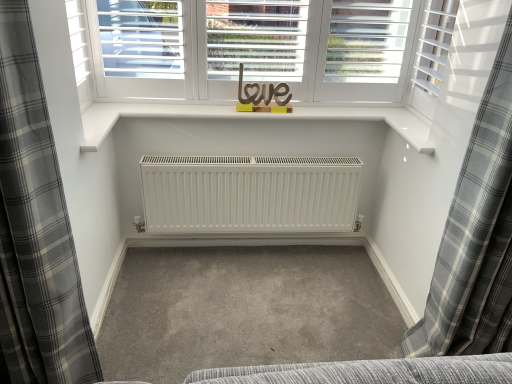
Question: Does white matte shutter at upper right come in front of gray plaid curtain at left, acting as the first curtain starting from the left?

Choices:
 (A) no
 (B) yes

Answer: (A)

Question: Can you confirm if white matte shutter at upper right is smaller than gray plaid curtain at left, positioned as the 2th curtain in right-to-left order?

Choices:
 (A) yes
 (B) no

Answer: (A)

Question: Can you confirm if white matte shutter at upper right is positioned to the left of gray plaid curtain at left, positioned as the 2th curtain in right-to-left order?

Choices:
 (A) no
 (B) yes

Answer: (A)

Question: From a real-world perspective, is white matte shutter at upper right below gray plaid curtain at left, acting as the first curtain starting from the left?

Choices:
 (A) no
 (B) yes

Answer: (A)

Question: Does white matte shutter at upper right touch gray plaid curtain at left, acting as the first curtain starting from the left?

Choices:
 (A) yes
 (B) no

Answer: (B)

Question: From their relative heights in the image, would you say white matte shutter at upper right is taller or shorter than gray plaid curtain at left, positioned as the 2th curtain in right-to-left order?

Choices:
 (A) tall
 (B) short

Answer: (B)

Question: Is white matte shutter at upper right wider or thinner than gray plaid curtain at left, positioned as the 2th curtain in right-to-left order?

Choices:
 (A) wide
 (B) thin

Answer: (B)

Question: Is white matte shutter at upper right to the left or to the right of gray plaid curtain at left, acting as the first curtain starting from the left, in the image?

Choices:
 (A) right
 (B) left

Answer: (A)

Question: From the image's perspective, relative to gray plaid curtain at left, acting as the first curtain starting from the left, is white matte shutter at upper right above or below?

Choices:
 (A) below
 (B) above

Answer: (B)

Question: Is point (12, 340) closer or farther from the camera than point (431, 23)?

Choices:
 (A) closer
 (B) farther

Answer: (A)

Question: From a real-world perspective, is gray plaid curtain at left, positioned as the 2th curtain in right-to-left order, physically located above or below white matte shutter at upper right?

Choices:
 (A) below
 (B) above

Answer: (A)

Question: Is gray plaid curtain at left, positioned as the 2th curtain in right-to-left order, taller or shorter than white matte shutter at upper right?

Choices:
 (A) tall
 (B) short

Answer: (A)

Question: In the image, is gray plaid curtain at left, acting as the first curtain starting from the left, positioned in front of or behind white matte shutter at upper right?

Choices:
 (A) behind
 (B) front

Answer: (B)

Question: Considering their positions, is gray plaid curtain at right, which ranks as the first curtain in right-to-left order, located in front of or behind white matte shutter at upper right?

Choices:
 (A) front
 (B) behind

Answer: (A)

Question: Would you say gray plaid curtain at right, placed as the second curtain when sorted from left to right, is to the left or to the right of white matte shutter at upper right in the picture?

Choices:
 (A) left
 (B) right

Answer: (B)